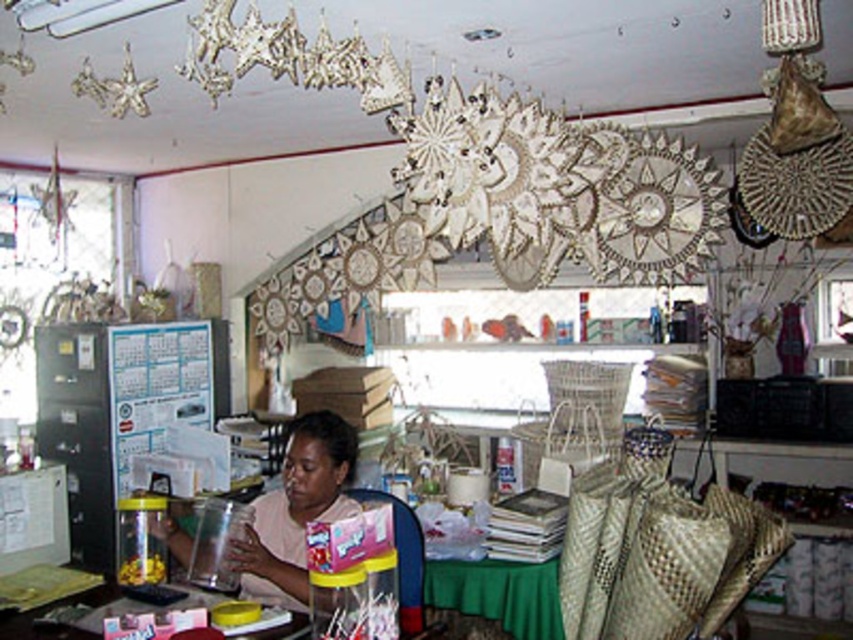
You are a customer in the craft shop and want to find the matte pink shirt at center. Based on the coordinates provided, can you estimate where the shirt is located in the room?

The matte pink shirt at center is located at coordinates point (296, 509), which means it is positioned slightly to the right and above the center of the room.

Looking at this image, you are standing in the craft shop and want to place a large craft project on the translucent plastic table at center. Where exactly should you go to find it?

The translucent plastic table at center is located at point (67,618).